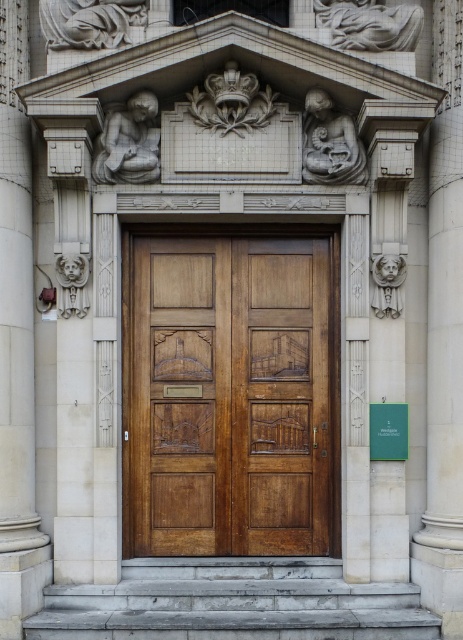
Who is more distant from viewer, (308, 284) or (204, 628)?

Point (308, 284)

I want to click on polished wood door at center, so click(x=226, y=394).

Which is more to the left, polished wood door at center or wooden carved door at center?

From the viewer's perspective, polished wood door at center appears more on the left side.

Does polished wood door at center have a larger size compared to wooden carved door at center?

Correct, polished wood door at center is larger in size than wooden carved door at center.

Which is behind, point (208, 525) or point (262, 260)?

Point (262, 260)

Find the location of a particular element. The width and height of the screenshot is (463, 640). polished wood door at center is located at coordinates (226, 394).

Who is higher up, wooden carved door at center or gray stone stairs at lower center?

wooden carved door at center is above.

Does wooden carved door at center appear over gray stone stairs at lower center?

Indeed, wooden carved door at center is positioned over gray stone stairs at lower center.

Where is `wooden carved door at center`? wooden carved door at center is located at coordinates (280, 396).

This screenshot has width=463, height=640. Find the location of `wooden carved door at center`. wooden carved door at center is located at coordinates (280, 396).